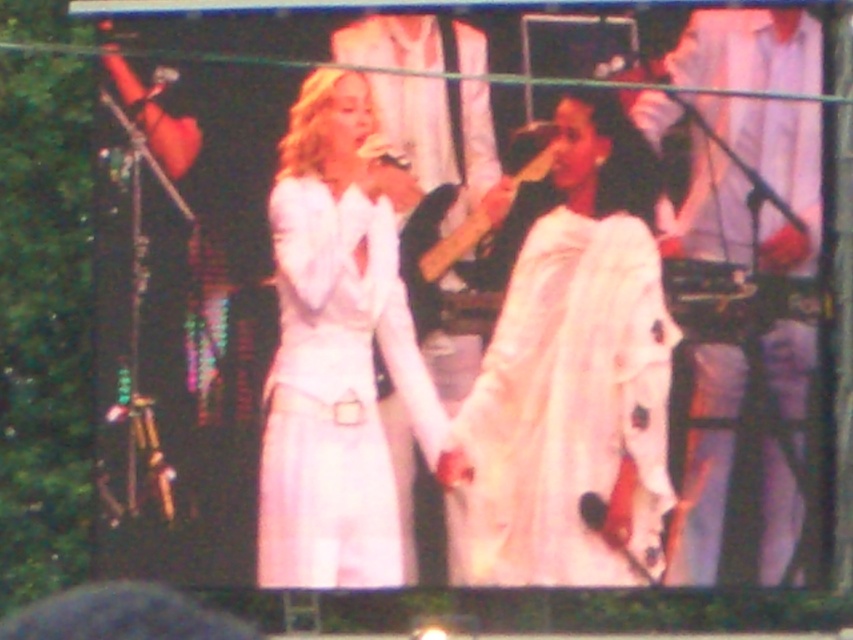
You are a photographer at the back of the stage. You want to take a photo of both the white satin dress at center and the white cotton shirt at right. Which one will appear larger in your photo?

The white satin dress at center will appear larger in the photo because it is closer to the viewer than the white cotton shirt at right.

You are a photographer standing behind a camera at the back of the stage. You want to take a photo of the white satin dress at center without moving the camera. Is the dress within your camera lens range? The camera has a maximum zoom range of 14 meters.

The white satin dress at center and the camera are 14.58 meters apart from each other. Since the camera can only zoom up to 14 meters, the dress is slightly out of range. You might need to move closer or use a different camera with a longer zoom capability.

You are a photographer at the back of the stage. You need to take a photo of the white cotton shirt at right and the wooden guitar at center. However, the stage lights are casting a shadow that might block part of the scene. Based on their heights, which object is less likely to be obscured by the shadow?

The wooden guitar at center is less likely to be obscured by the shadow because the white cotton shirt at right is much taller than it, meaning the shirt could cast a shadow over the guitar.